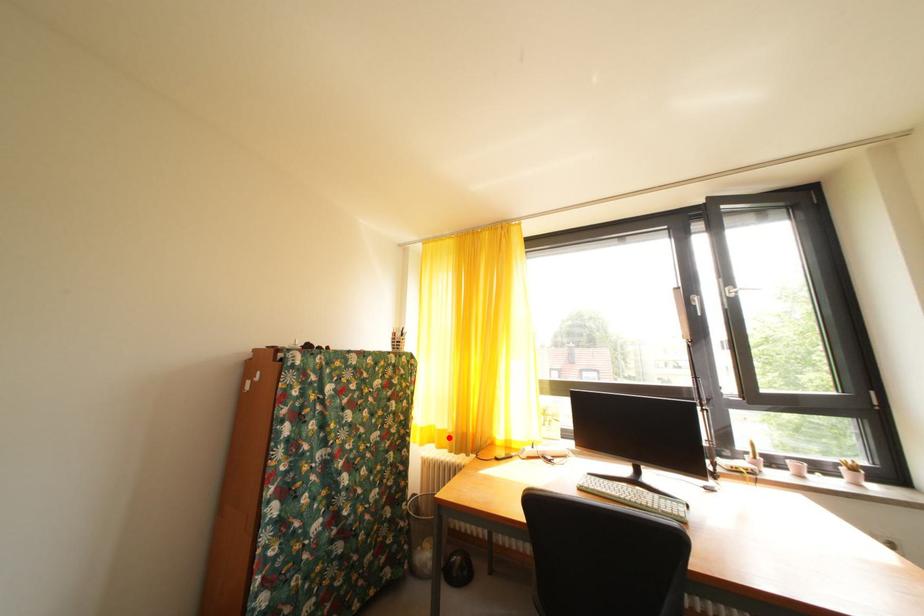
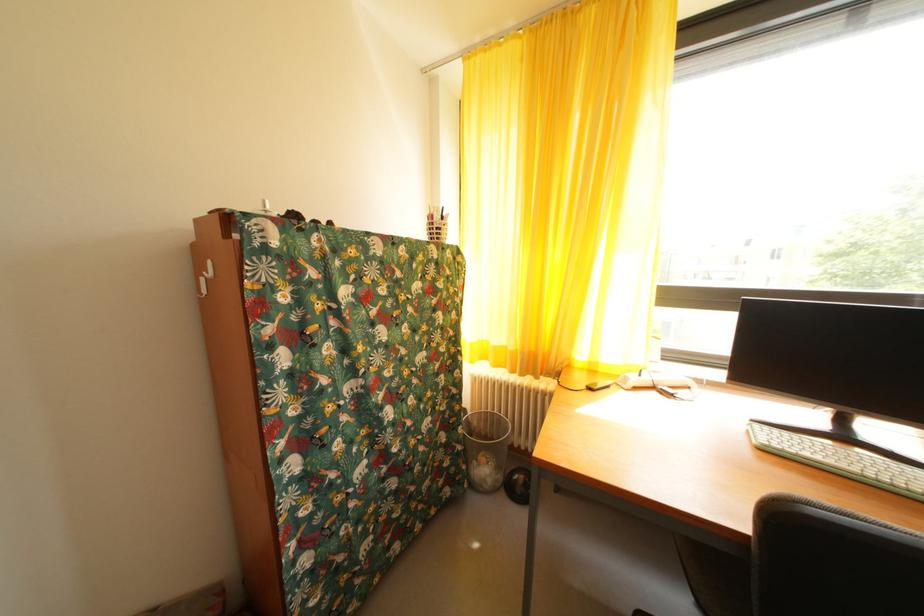
Where in the second image is the point corresponding to the highlighted location from the first image?

(505, 354)